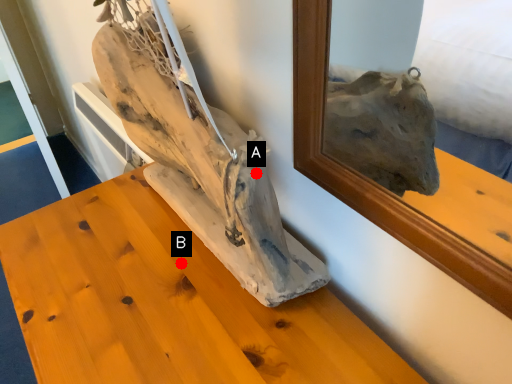
Question: Two points are circled on the image, labeled by A and B beside each circle. Which point appears closest to the camera in this image?

Choices:
 (A) A is closer
 (B) B is closer

Answer: (A)